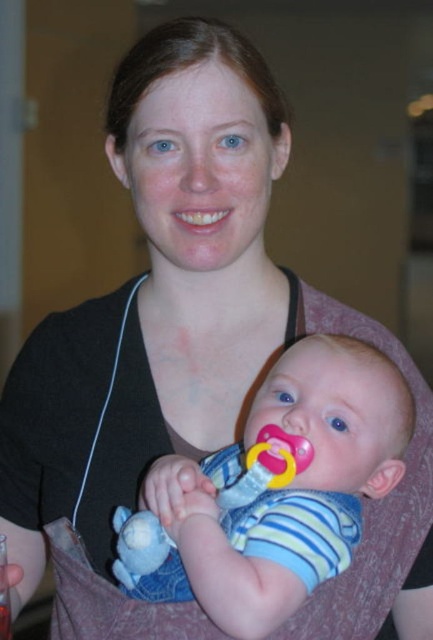
Question: Which object is closer to the camera taking this photo?

Choices:
 (A) striped fabric baby at center
 (B) pink rubber pacifier at center

Answer: (A)

Question: Does striped fabric baby at center have a greater width compared to pink rubber pacifier at center?

Choices:
 (A) yes
 (B) no

Answer: (A)

Question: Which point is closer to the camera?

Choices:
 (A) (145, 582)
 (B) (122, 516)

Answer: (A)

Question: Considering the relative positions of striped fabric baby at center and pink rubber pacifier at center in the image provided, where is striped fabric baby at center located with respect to pink rubber pacifier at center?

Choices:
 (A) below
 (B) above

Answer: (B)

Question: Is striped fabric baby at center above pink rubber pacifier at center?

Choices:
 (A) no
 (B) yes

Answer: (B)